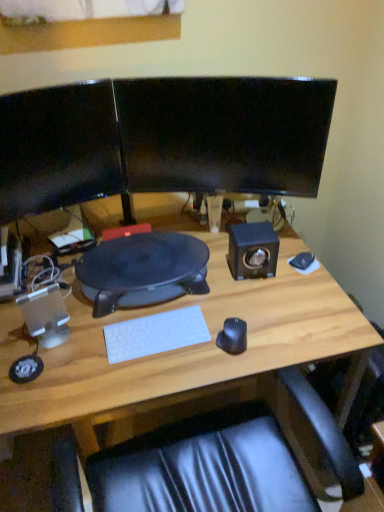
Identify the location of unoccupied region to the right of black matte mouse at center. This screenshot has height=512, width=384. (284, 336).